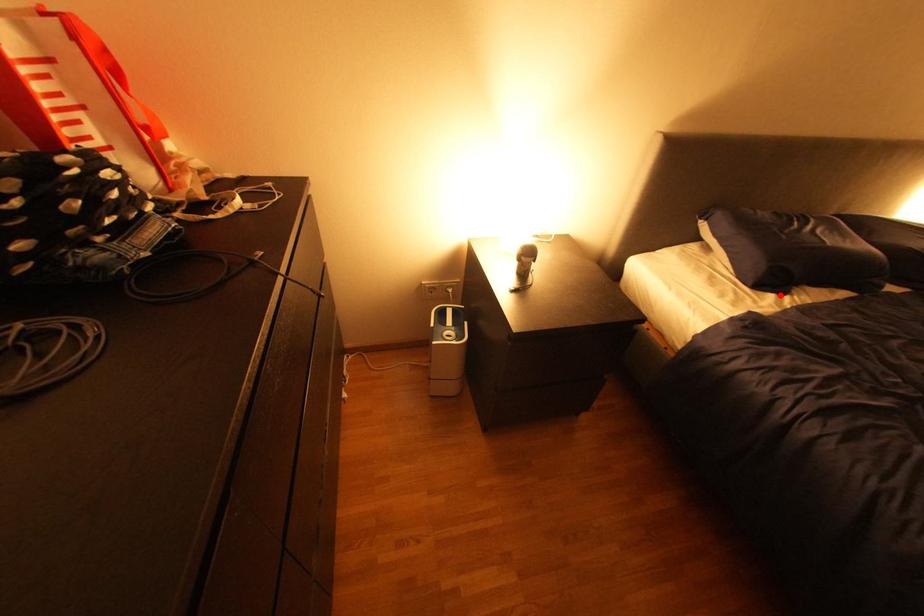
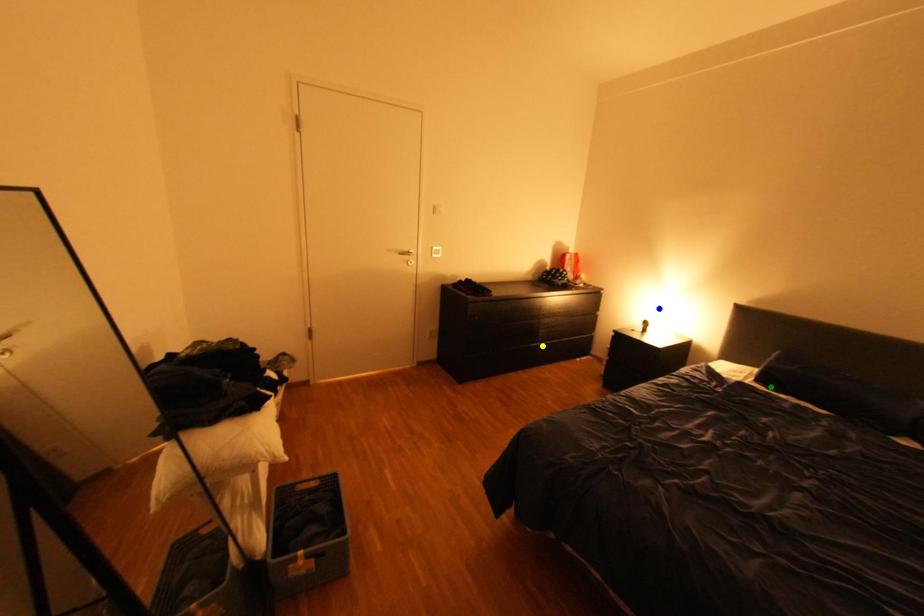
Question: I am providing you with two images of the same scene from different viewpoints. A red point is marked on the first image. You are given multiple points on the second image. Which point in image 2 is actually the same real-world point as the red point in image 1?

Choices:
 (A) green point
 (B) blue point
 (C) yellow point

Answer: (A)